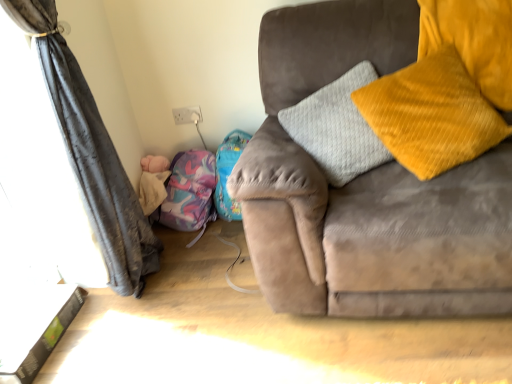
Identify the location of vacant area situated below dark grey fabric curtain at left (from a real-world perspective). (113, 317).